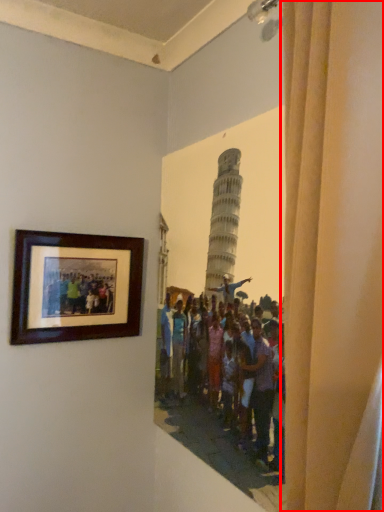
Question: From the image, what is the correct spatial relationship of curtain (annotated by the red box) in relation to picture frame?

Choices:
 (A) left
 (B) right

Answer: (B)